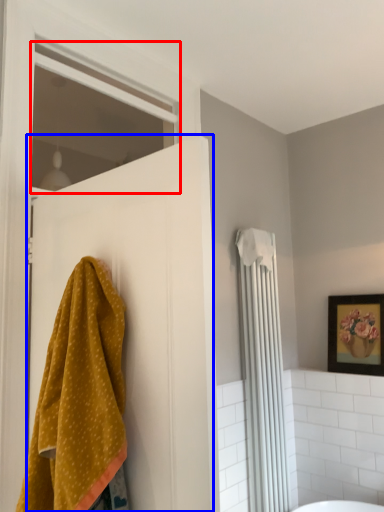
Question: Which object is further to the camera taking this photo, window (highlighted by a red box) or door (highlighted by a blue box)?

Choices:
 (A) window
 (B) door

Answer: (A)